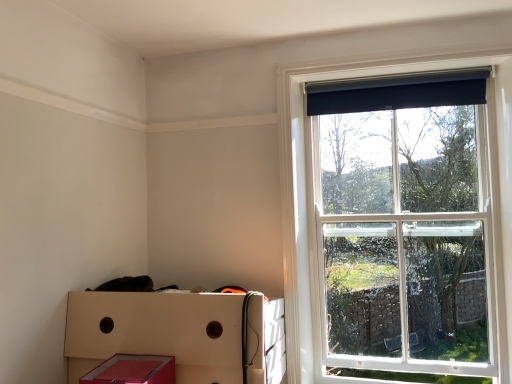
Question: Looking at the image, does matte red plastic crate at lower left seem bigger or smaller compared to black fabric curtain at upper right?

Choices:
 (A) small
 (B) big

Answer: (B)

Question: Considering the positions of matte red plastic crate at lower left and black fabric curtain at upper right in the image, is matte red plastic crate at lower left taller or shorter than black fabric curtain at upper right?

Choices:
 (A) short
 (B) tall

Answer: (B)

Question: Estimate the real-world distances between objects in this image. Which object is farther from the black roller blind at upper right?

Choices:
 (A) black fabric curtain at upper right
 (B) matte red storage box at lower left
 (C) matte red plastic crate at lower left

Answer: (B)

Question: Which of these objects is positioned closest to the matte red plastic crate at lower left?

Choices:
 (A) matte red storage box at lower left
 (B) black roller blind at upper right
 (C) black fabric curtain at upper right

Answer: (A)